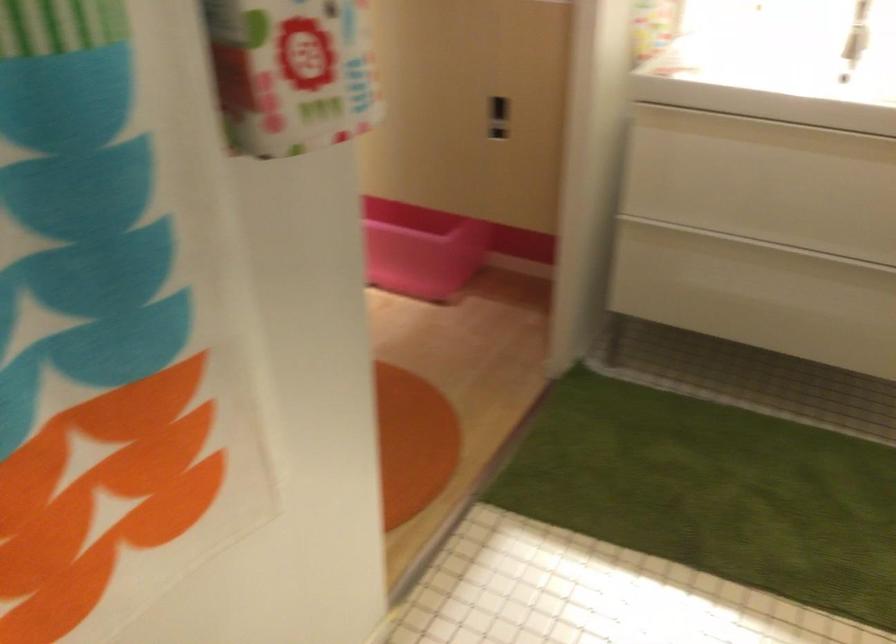
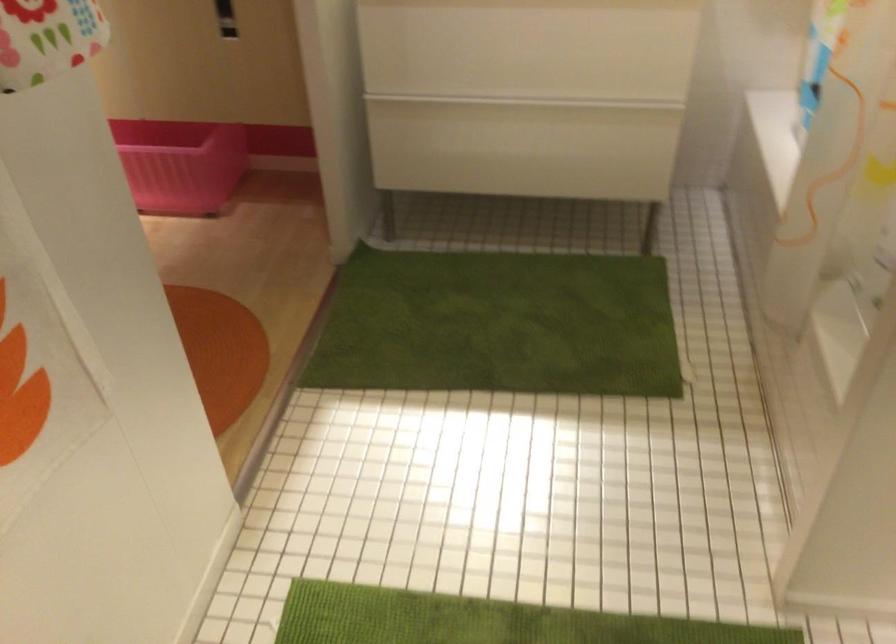
Question: The camera is either moving clockwise (left) or counter-clockwise (right) around the object. The first image is from the beginning of the video and the second image is from the end. Is the camera moving left or right when shooting the video?

Choices:
 (A) Left
 (B) Right

Answer: (A)